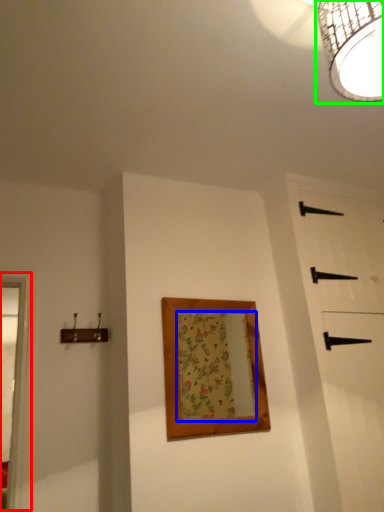
Question: Estimate the real-world distances between objects in this image. Which object is closer to window frame (highlighted by a red box), mirror (highlighted by a blue box) or lamp (highlighted by a green box)?

Choices:
 (A) mirror
 (B) lamp

Answer: (A)